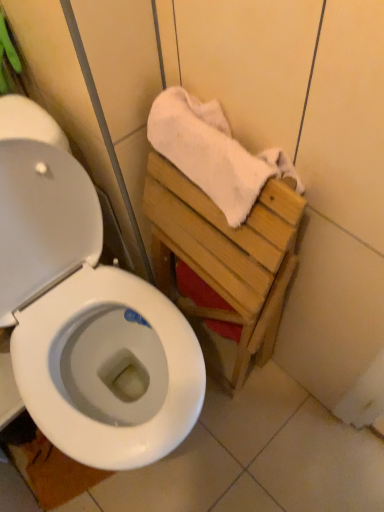
In order to face white glossy toilet seat at lower left, should I rotate leftwards or rightwards?

To align with it, rotate left about 15.848°.

Identify the location of white glossy toilet seat at lower left. The width and height of the screenshot is (384, 512). (47, 465).

Image resolution: width=384 pixels, height=512 pixels. What do you see at coordinates (47, 465) in the screenshot?
I see `white glossy toilet seat at lower left` at bounding box center [47, 465].

What do you see at coordinates (209, 152) in the screenshot? The width and height of the screenshot is (384, 512). I see `white cotton towel at upper right` at bounding box center [209, 152].

At what (x,y) coordinates should I click in order to perform the action: click on white cotton towel at upper right. Please return your answer as a coordinate pair (x, y). Looking at the image, I should click on (209, 152).

Locate an element on the screen. The width and height of the screenshot is (384, 512). white glossy toilet seat at lower left is located at coordinates (47, 465).

Is white cotton towel at upper right at the left side of white glossy toilet seat at lower left?

In fact, white cotton towel at upper right is to the right of white glossy toilet seat at lower left.

Which object is closer to the camera, white cotton towel at upper right or white glossy toilet seat at lower left?

white cotton towel at upper right is closer to the camera.

Is point (198, 129) farther from viewer compared to point (28, 455)?

That is False.

From the picture: From the image's perspective, between white cotton towel at upper right and white glossy toilet seat at lower left, who is located below?

white glossy toilet seat at lower left appears lower in the image.

From a real-world perspective, is white cotton towel at upper right above or below white glossy toilet seat at lower left?

From a real-world perspective, white cotton towel at upper right is physically above white glossy toilet seat at lower left.

Can you confirm if white cotton towel at upper right is wider than white glossy toilet seat at lower left?

Yes, white cotton towel at upper right is wider than white glossy toilet seat at lower left.

In the scene shown: Is white cotton towel at upper right taller or shorter than white glossy toilet seat at lower left?

A: In the image, white cotton towel at upper right appears to be taller than white glossy toilet seat at lower left.

Which of these two, white cotton towel at upper right or white glossy toilet seat at lower left, is smaller?

white glossy toilet seat at lower left is smaller.

Would you say white cotton towel at upper right is outside white glossy toilet seat at lower left?

Yes, white cotton towel at upper right is located beyond the bounds of white glossy toilet seat at lower left.

Are white cotton towel at upper right and white glossy toilet seat at lower left located far from each other?

white cotton towel at upper right is actually quite close to white glossy toilet seat at lower left.

Is white cotton towel at upper right facing towards white glossy toilet seat at lower left?

No, white cotton towel at upper right is not oriented towards white glossy toilet seat at lower left.

What's the angular difference between white cotton towel at upper right and white glossy toilet seat at lower left's facing directions?

The facing directions of white cotton towel at upper right and white glossy toilet seat at lower left are 0.000816 degrees apart.

Find the location of a particular element. This screenshot has height=512, width=384. tile below the white cotton towel at upper right (from a real-world perspective) is located at coordinates (47, 465).

Which object is positioned more to the left, white glossy toilet seat at lower left or white cotton towel at upper right?

From the viewer's perspective, white glossy toilet seat at lower left appears more on the left side.

From the picture: Is white glossy toilet seat at lower left in front of or behind white cotton towel at upper right in the image?

white glossy toilet seat at lower left is positioned farther from the viewer than white cotton towel at upper right.

Does point (13, 443) appear closer or farther from the camera than point (184, 167)?

Point (13, 443) is positioned farther from the camera compared to point (184, 167).

From the image's perspective, which one is positioned higher, white glossy toilet seat at lower left or white cotton towel at upper right?

From the image's view, white cotton towel at upper right is above.

From a real-world perspective, does white glossy toilet seat at lower left stand above white cotton towel at upper right?

Actually, white glossy toilet seat at lower left is physically below white cotton towel at upper right in the real world.

Is white glossy toilet seat at lower left thinner than white cotton towel at upper right?

Yes.

Is white glossy toilet seat at lower left taller or shorter than white cotton towel at upper right?

white glossy toilet seat at lower left is shorter than white cotton towel at upper right.

Between white glossy toilet seat at lower left and white cotton towel at upper right, which one has larger size?

white cotton towel at upper right.

Is white glossy toilet seat at lower left situated inside white cotton towel at upper right or outside?

white glossy toilet seat at lower left cannot be found inside white cotton towel at upper right.

Is white glossy toilet seat at lower left next to white cotton towel at upper right and touching it?

white glossy toilet seat at lower left and white cotton towel at upper right are clearly separated.

Is white cotton towel at upper right at the back of white glossy toilet seat at lower left?

No, white glossy toilet seat at lower left is not facing away from white cotton towel at upper right.

How many degrees apart are the facing directions of white glossy toilet seat at lower left and white cotton towel at upper right?

There is a 0.000816-degree angle between the facing directions of white glossy toilet seat at lower left and white cotton towel at upper right.

Measure the distance between white glossy toilet seat at lower left and white cotton towel at upper right.

white glossy toilet seat at lower left is 82.91 centimeters away from white cotton towel at upper right.

Find the location of a particular element. Image resolution: width=384 pixels, height=512 pixels. tile that appears below the white cotton towel at upper right (from a real-world perspective) is located at coordinates (47, 465).

Locate an element on the screen. The image size is (384, 512). bath towel located on the right of white glossy toilet seat at lower left is located at coordinates (209, 152).

Locate an element on the screen. tile on the left of white cotton towel at upper right is located at coordinates (47, 465).